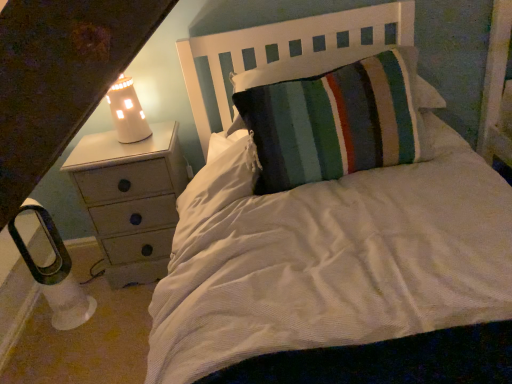
The width and height of the screenshot is (512, 384). What are the coordinates of `vacant space in front of white ceramic lamp at upper left, the 2th lamp ordered from the bottom` in the screenshot? It's located at (130, 155).